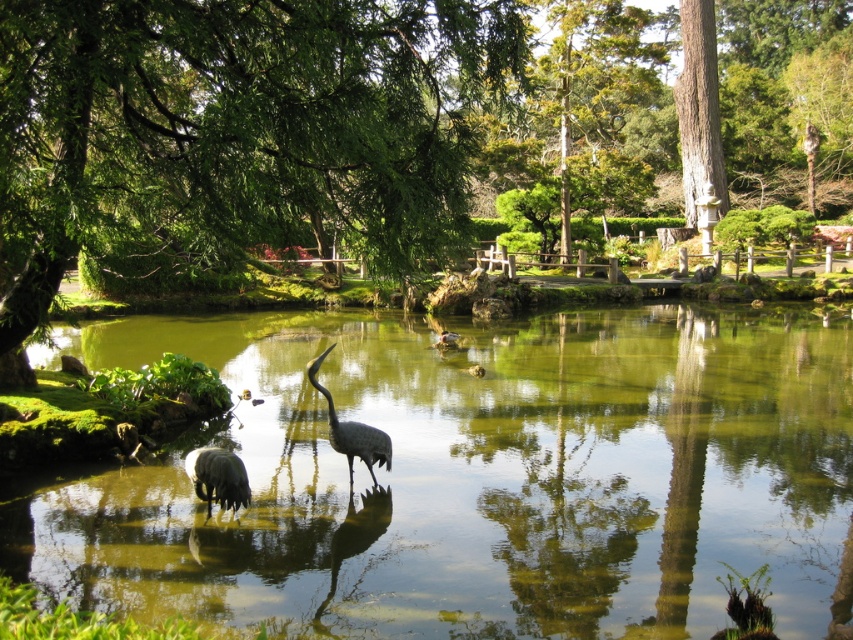
You are standing in the garden and want to reach the smooth brown tree trunk at upper right. If you can walk at a speed of 3 feet per second, how many seconds will it take you to reach the tree trunk?

The smooth brown tree trunk at upper right is 121.71 feet away from the viewer. At a walking speed of 3 feet per second, it would take approximately 40.57 seconds to reach the tree trunk.

You are a photographer trying to capture the entire scene of the green reflective water at center and the smooth brown tree trunk at upper right in a single shot. Given that your camera can only focus on objects within a 100cm width, will both objects fit in the frame?

The green reflective water at center is bigger than the smooth brown tree trunk at upper right. Since the camera can focus on objects within 100cm width, both objects can fit in the frame as their combined size is likely under 100cm.

You are a photographer aiming to capture the reflection of the smooth brown tree trunk at upper right in the green reflective water at center. Based on their positions, can you determine if the tree trunk is visible in the water?

The green reflective water at center is positioned on the left side of smooth brown tree trunk at upper right, so the tree trunk is likely visible in the water as its reflection would appear in the water to the left of its actual position.